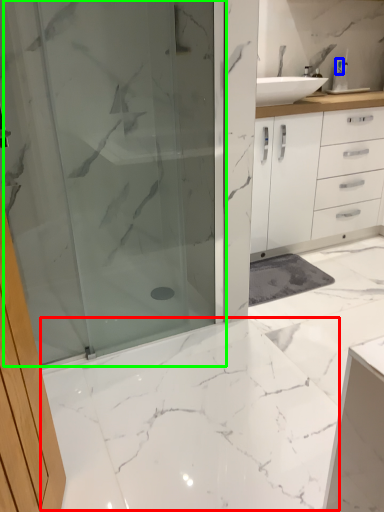
Question: Based on their relative distances, which object is farther from marble (highlighted by a red box)? Choose from toiletry (highlighted by a blue box) and shower door (highlighted by a green box).

Choices:
 (A) toiletry
 (B) shower door

Answer: (A)